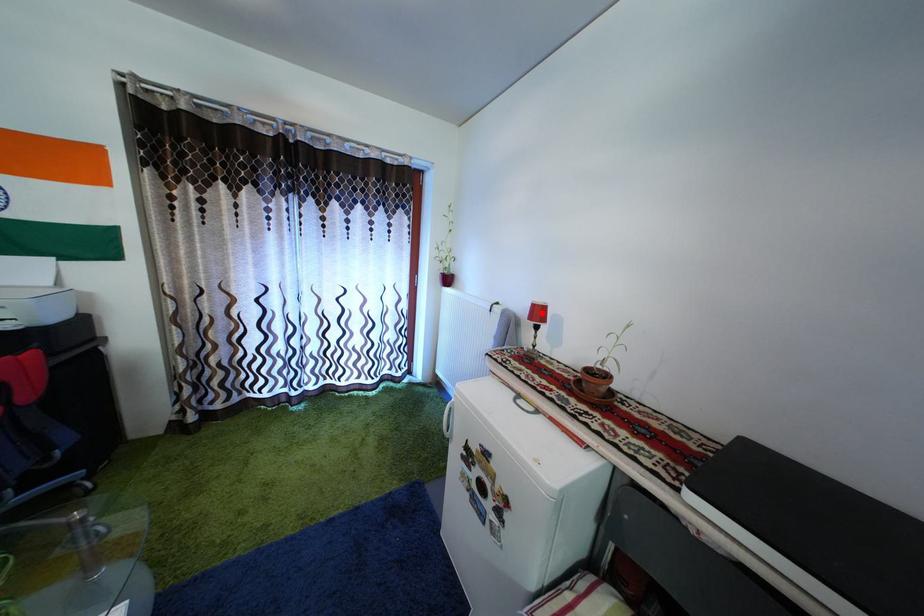
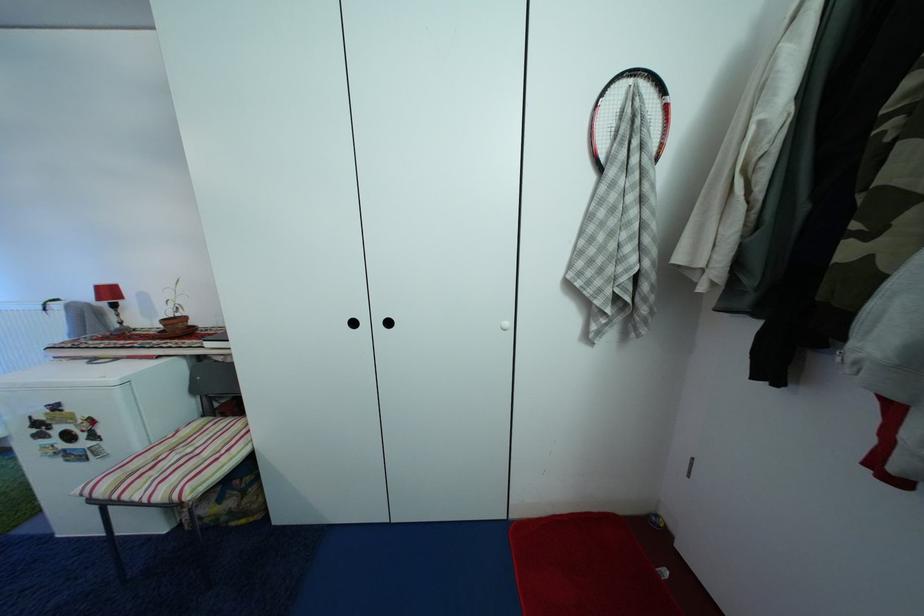
The point at the highlighted location is marked in the first image. Where is the corresponding point in the second image?

(106, 294)